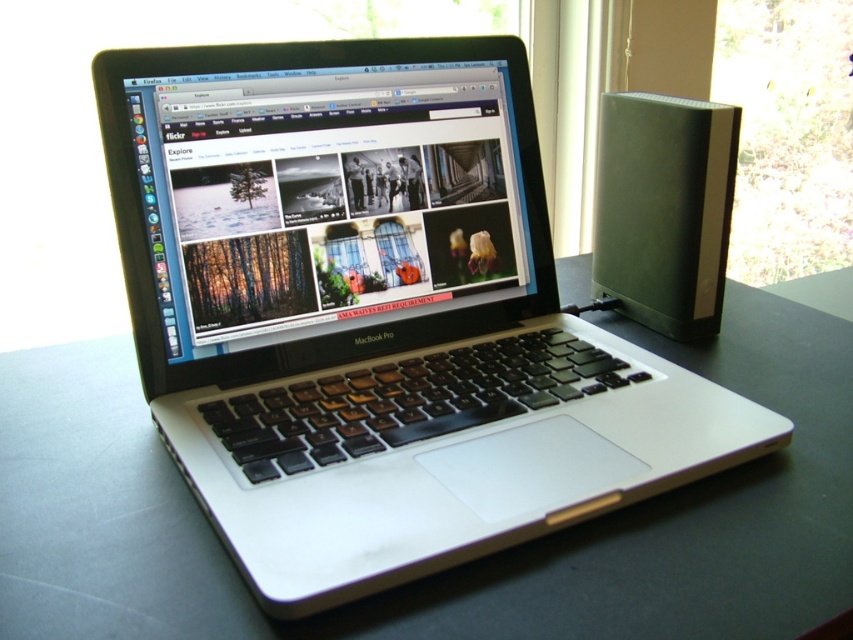
Question: Which point is farther to the camera?

Choices:
 (A) transparent glass window at upper right
 (B) satin black laptop at center

Answer: (A)

Question: Can you confirm if satin black laptop at center is bigger than transparent glass window at upper right?

Choices:
 (A) no
 (B) yes

Answer: (A)

Question: Is satin black laptop at center positioned before transparent glass window at upper right?

Choices:
 (A) yes
 (B) no

Answer: (A)

Question: Observing the image, what is the correct spatial positioning of satin black laptop at center in reference to transparent glass window at upper right?

Choices:
 (A) right
 (B) left

Answer: (B)

Question: Which point is closer to the camera?

Choices:
 (A) (811, 180)
 (B) (143, 193)

Answer: (B)

Question: Which point is farther to the camera?

Choices:
 (A) transparent glass window at upper right
 (B) satin black laptop at center

Answer: (A)